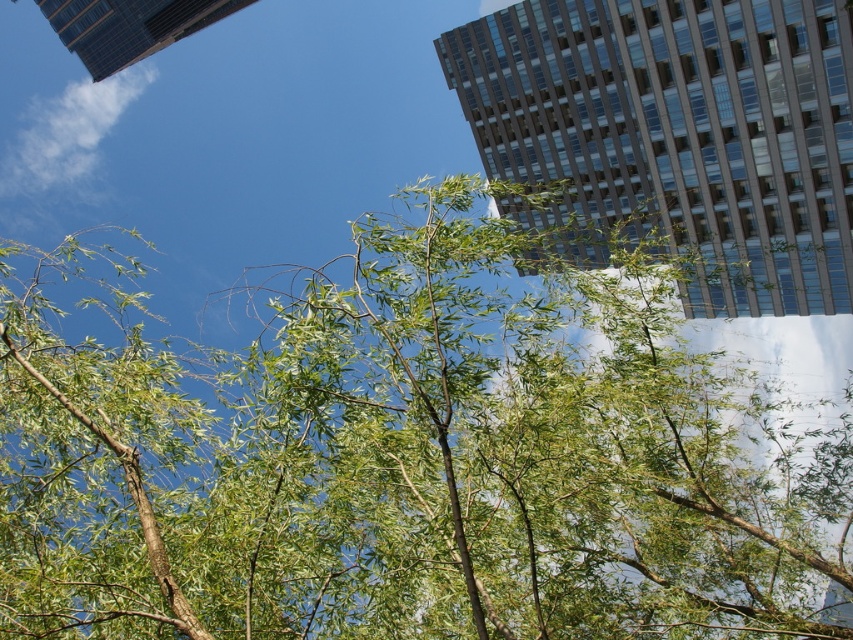
Question: Considering the real-world distances, which object is closest to the glassy steel skyscraper at upper left?

Choices:
 (A) green leafy branches at center
 (B) glassy reflective building at upper right

Answer: (B)

Question: Does glassy reflective building at upper right have a smaller size compared to glassy steel skyscraper at upper left?

Choices:
 (A) no
 (B) yes

Answer: (A)

Question: Does glassy reflective building at upper right appear over glassy steel skyscraper at upper left?

Choices:
 (A) yes
 (B) no

Answer: (B)

Question: Can you confirm if glassy reflective building at upper right is thinner than glassy steel skyscraper at upper left?

Choices:
 (A) yes
 (B) no

Answer: (A)

Question: Which point is farther to the camera?

Choices:
 (A) green leafy branches at center
 (B) glassy reflective building at upper right
 (C) glassy steel skyscraper at upper left

Answer: (C)

Question: Which point is farther to the camera?

Choices:
 (A) glassy reflective building at upper right
 (B) green leafy branches at center

Answer: (A)